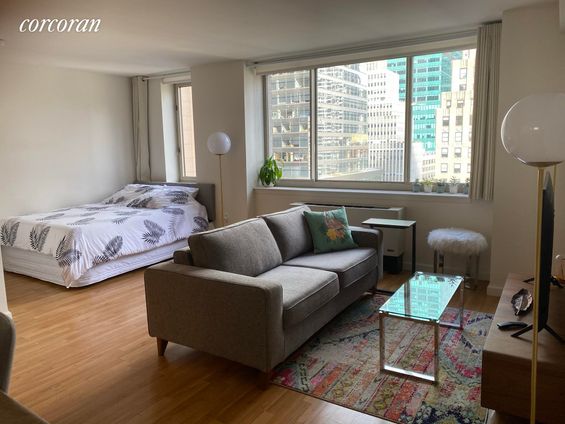
Identify the location of sofa. [281, 271].